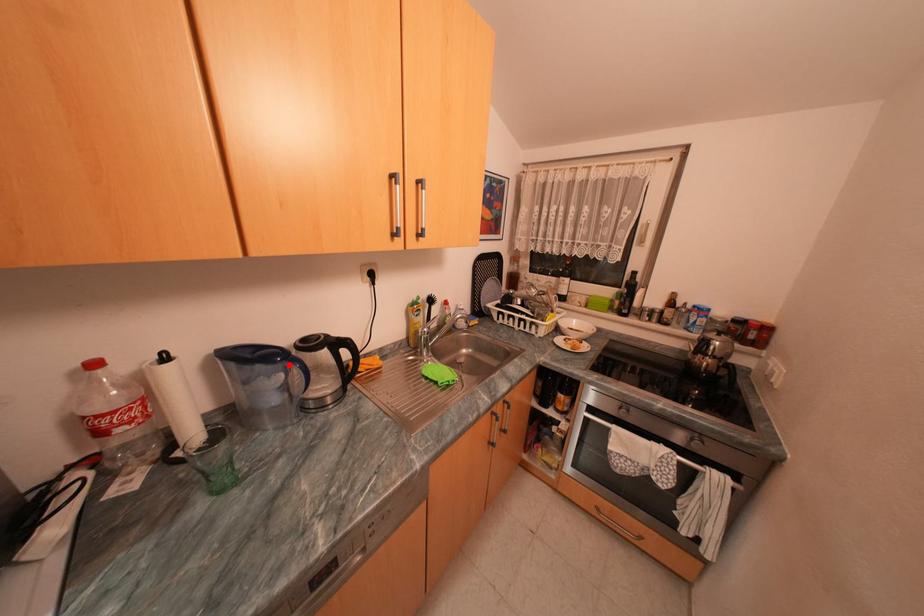
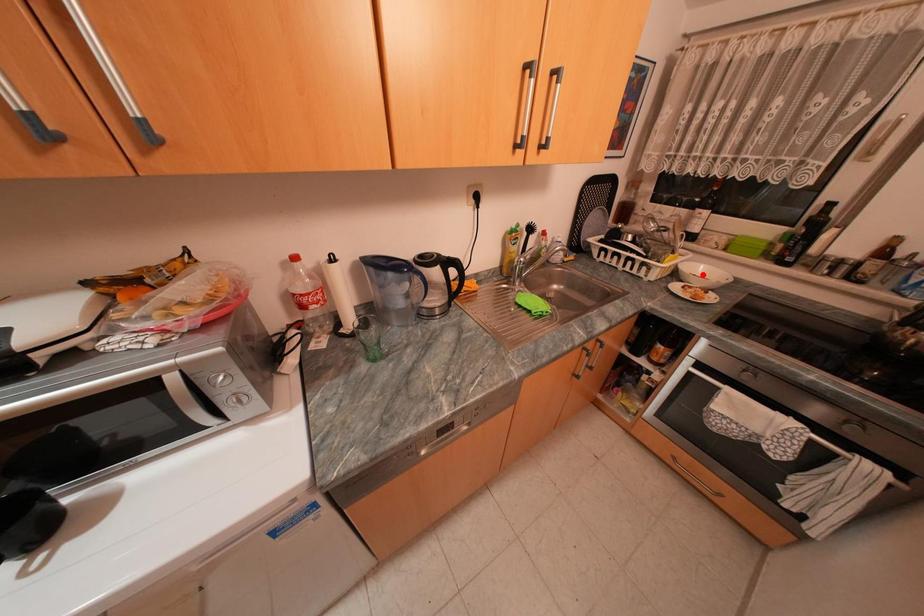
In the scene shown: I am providing you with two images of the same scene from different viewpoints. A red point is marked on the first image and another point is marked on the second image. Are the points marked in image1 and image2 representing the same 3D position?

No